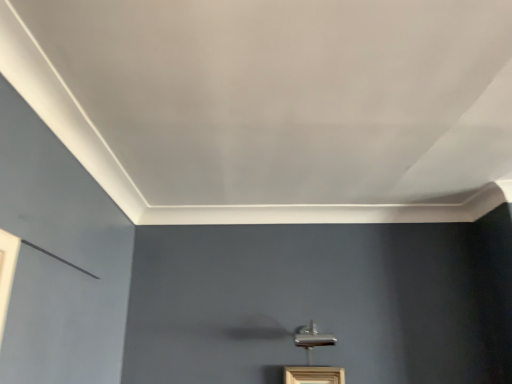
What do you see at coordinates (313, 375) in the screenshot? I see `wooden frame at lower center` at bounding box center [313, 375].

At what (x,y) coordinates should I click in order to perform the action: click on wooden frame at lower center. Please return your answer as a coordinate pair (x, y). Looking at the image, I should click on (313, 375).

This screenshot has width=512, height=384. I want to click on wooden frame at lower center, so click(x=313, y=375).